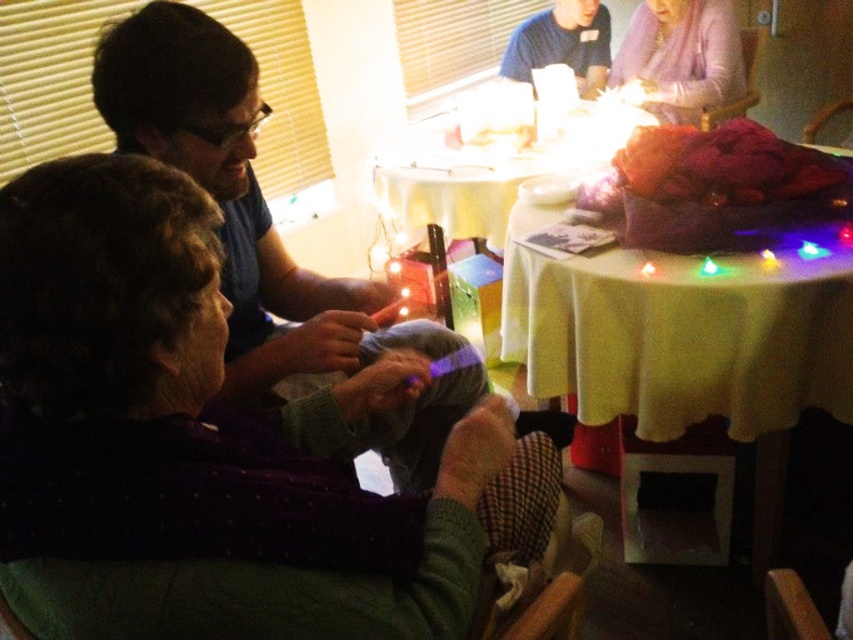
Question: Which of the following is the farthest from the observer?

Choices:
 (A) (490, 189)
 (B) (830, 378)

Answer: (A)

Question: From the image, what is the correct spatial relationship of yellow fabric table at upper center in relation to matte blue shirt at left?

Choices:
 (A) below
 (B) above

Answer: (A)

Question: Which point appears closest to the camera in this image?

Choices:
 (A) (527, 52)
 (B) (178, 38)

Answer: (B)

Question: Is matte blue shirt at left further to camera compared to blue t-shirt at upper center?

Choices:
 (A) yes
 (B) no

Answer: (B)

Question: Can you confirm if yellow fabric table at center is wider than blue t-shirt at upper center?

Choices:
 (A) yes
 (B) no

Answer: (A)

Question: Among these points, which one is nearest to the camera?

Choices:
 (A) (672, 99)
 (B) (743, 360)
 (C) (519, 160)
 (D) (599, 26)

Answer: (B)